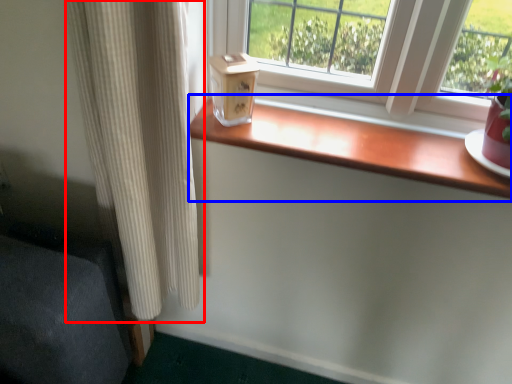
Question: Which object is further to the camera taking this photo, curtain (highlighted by a red box) or window sill (highlighted by a blue box)?

Choices:
 (A) curtain
 (B) window sill

Answer: (B)